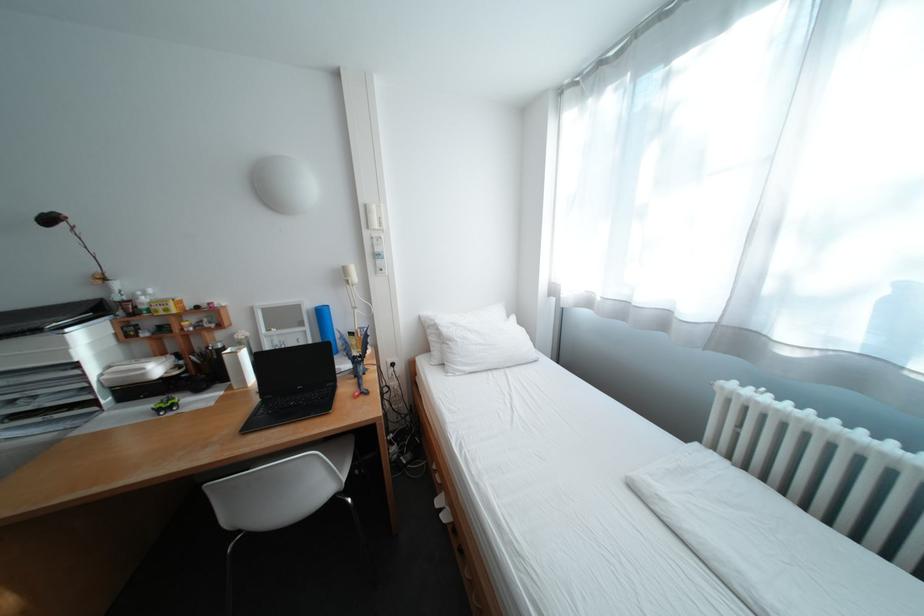
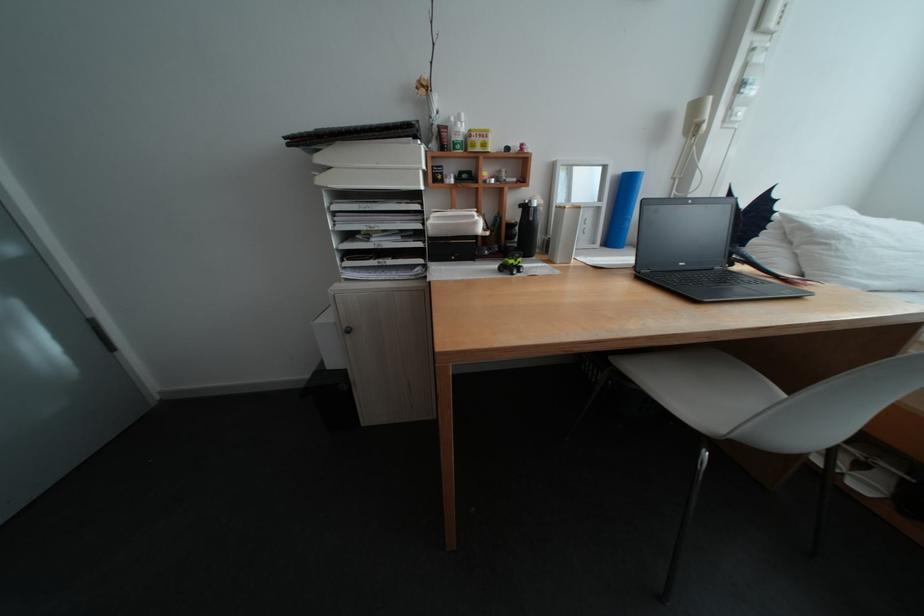
Question: Which direction would the cameraman need to move to produce the second image? Reply with the corresponding letter.

Choices:
 (A) Left
 (B) Right
 (C) Forward
 (D) Backward

Answer: (A)